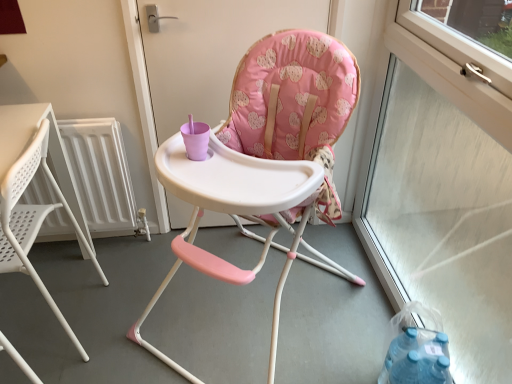
Locate an element on the screen. This screenshot has height=384, width=512. free space in front of pink fabric high chair at center is located at coordinates (240, 294).